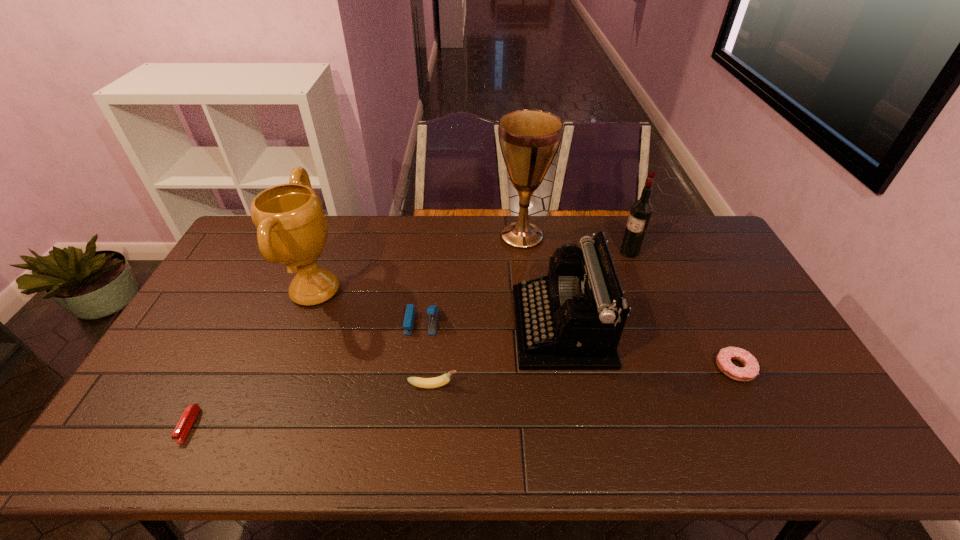
Where is `object identified as the second closest to the typewriter`? This screenshot has width=960, height=540. object identified as the second closest to the typewriter is located at coordinates (529, 139).

I want to click on vacant space that satisfies the following two spatial constraints: 1. on the back side of the rightmost object; 2. on the front of the award with the decoration, so click(x=696, y=291).

Where is `free region that satisfies the following two spatial constraints: 1. on the front and back of the wine bottle; 2. on the front-facing side of the leftmost object`? This screenshot has height=540, width=960. free region that satisfies the following two spatial constraints: 1. on the front and back of the wine bottle; 2. on the front-facing side of the leftmost object is located at coordinates (696, 425).

This screenshot has width=960, height=540. What are the coordinates of `vacant region that satisfies the following two spatial constraints: 1. on the front and back of the seventh object from left to right; 2. on the front-facing side of the nearest object` in the screenshot? It's located at (696, 425).

Locate an element on the screen. free spot that satisfies the following two spatial constraints: 1. on the back side of the rightmost object; 2. on the front and back of the second object from right to left is located at coordinates (676, 252).

Image resolution: width=960 pixels, height=540 pixels. In order to click on free location that satisfies the following two spatial constraints: 1. on the front side of the tallest object; 2. at the stem of the banana in this screenshot , I will do `click(539, 386)`.